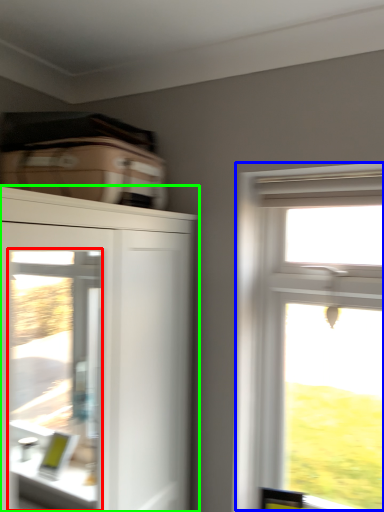
Question: Estimate the real-world distances between objects in this image. Which object is farther from screen door (highlighted by a red box), window (highlighted by a blue box) or cupboard (highlighted by a green box)?

Choices:
 (A) window
 (B) cupboard

Answer: (A)